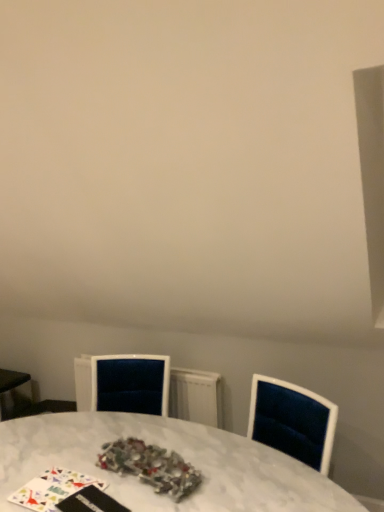
Locate an element on the screen. vacant area located to the right-hand side of shiny metallic tinsel at center is located at coordinates (214, 468).